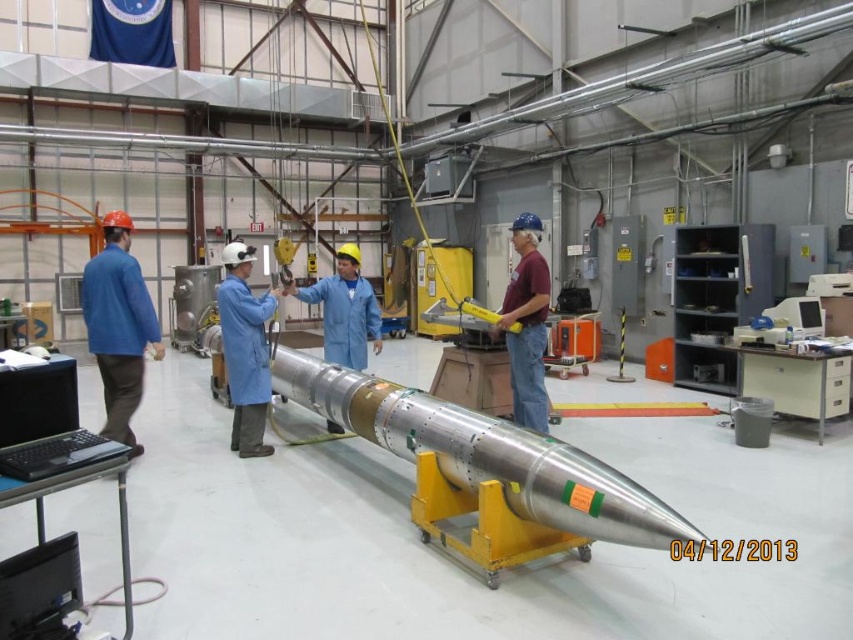
Based on the scene description, where is the metallic silver rocket at center positioned in terms of its 2D coordinates?

The metallic silver rocket at center is positioned at the 2D coordinates point (486, 452).

You are an engineer inspecting the rocket in the cleanroom. You notice two points marked on the rocket surface at coordinates point (595, 492) and point (349, 365). Which point is nearer to your current position?

Point (595, 492) is closer to the viewer than point (349, 365), so the point at (595, 492) is nearer to your current position.

You are an engineer standing at the camera position in the industrial workspace. You need to reach the blue fabric jacket at left to retrieve a tool. Is the jacket within a 5 meter reach from your current position?

The blue fabric jacket at left is 4.93 meters away from the camera position, so yes, it is within a 5 meter reach.